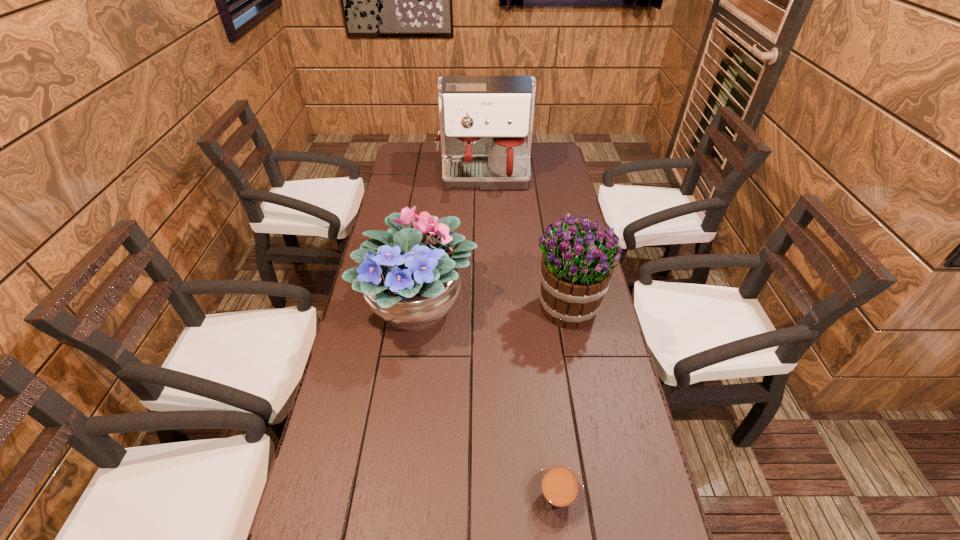
Where is `object that is at the left edge`? object that is at the left edge is located at coordinates (410, 279).

Identify the location of coffee maker present at the right edge. This screenshot has height=540, width=960. (486, 121).

You are a GUI agent. You are given a task and a screenshot of the screen. Output one action in this format:
    pyautogui.click(x=<x>, y=<y>)
    Task: Click on the bouquet located in the right edge section of the desktop
    The width and height of the screenshot is (960, 540).
    Given the screenshot: What is the action you would take?
    pyautogui.click(x=576, y=269)

This screenshot has width=960, height=540. In order to click on cappuccino at the right edge in this screenshot , I will do `click(556, 493)`.

You are a GUI agent. You are given a task and a screenshot of the screen. Output one action in this format:
    pyautogui.click(x=<x>, y=<y>)
    Task: Click on the object that is at the far right corner
    The width and height of the screenshot is (960, 540).
    Given the screenshot: What is the action you would take?
    pyautogui.click(x=486, y=121)

This screenshot has width=960, height=540. Identify the location of free space at the left edge of the desktop. (427, 181).

Where is `vacant space at the right edge of the desktop`? The height and width of the screenshot is (540, 960). vacant space at the right edge of the desktop is located at coordinates (596, 396).

The width and height of the screenshot is (960, 540). What are the coordinates of `vacant area at the far right corner` in the screenshot? It's located at (543, 143).

Identify the location of free space between the nearest object and the left bouquet. (488, 401).

You are a GUI agent. You are given a task and a screenshot of the screen. Output one action in this format:
    pyautogui.click(x=<x>, y=<y>)
    Task: Click on the free space that is in between the nearest object and the left bouquet
    
    Given the screenshot: What is the action you would take?
    pyautogui.click(x=488, y=401)